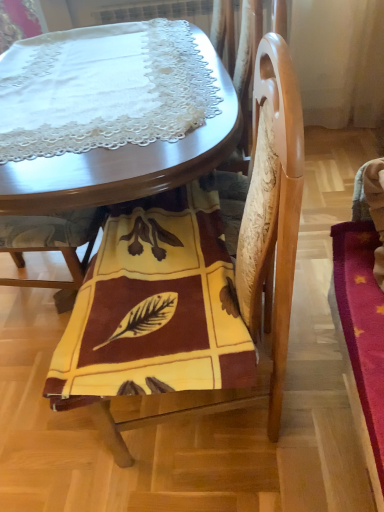
The width and height of the screenshot is (384, 512). Describe the element at coordinates (52, 246) in the screenshot. I see `yellow fabric chair at center, marked as the first chair in a left-to-right arrangement` at that location.

Measure the distance between point (226, 93) and camera.

Point (226, 93) and camera are 1.31 meters apart.

Identify the location of yellow fabric at lower center. (154, 308).

Which of these two, wooden table at center or yellow fabric chair at center, which appears as the second chair when viewed from the right, is thinner?

Thinner between the two is yellow fabric chair at center, which appears as the second chair when viewed from the right.

Is wooden table at center far away from yellow fabric chair at center, which appears as the second chair when viewed from the right?

No.

Considering the relative positions of wooden table at center and yellow fabric chair at center, which appears as the second chair when viewed from the right, in the image provided, is wooden table at center to the left or to the right of yellow fabric chair at center, which appears as the second chair when viewed from the right,?

In the image, wooden table at center appears on the right side of yellow fabric chair at center, which appears as the second chair when viewed from the right.

What's the angular difference between wooden table at center and yellow fabric chair at center, which appears as the second chair when viewed from the right,'s facing directions?

They differ by 85.8 degrees in their facing directions.

Are yellow fabric at lower center and wooden table at center beside each other?

No, yellow fabric at lower center is not touching wooden table at center.

Is yellow fabric at lower center taller than wooden table at center?

No.

Considering the relative positions of yellow fabric at lower center and wooden table at center in the image provided, is yellow fabric at lower center to the left of wooden table at center from the viewer's perspective?

No, yellow fabric at lower center is not to the left of wooden table at center.

What are the coordinates of `chair below the yellow fabric chair at center, marked as the first chair in a left-to-right arrangement (from the image's perspective)` in the screenshot? It's located at point(189,278).

From the image's perspective, is yellow woolen blanket at center, which is the 2th chair from left to right, over yellow fabric chair at center, marked as the first chair in a left-to-right arrangement?

Actually, yellow woolen blanket at center, which is the 2th chair from left to right, appears below yellow fabric chair at center, marked as the first chair in a left-to-right arrangement, in the image.

Which object is further away from the camera, yellow woolen blanket at center, which is the 2th chair from left to right, or yellow fabric chair at center, marked as the first chair in a left-to-right arrangement?

yellow fabric chair at center, marked as the first chair in a left-to-right arrangement.

From a real-world perspective, is wooden table at center on yellow woolen blanket at center, which is the 2th chair from left to right?

No, from a real-world perspective, wooden table at center is not on top of yellow woolen blanket at center, which is the 2th chair from left to right.

From the picture: Considering the positions of objects wooden table at center and yellow woolen blanket at center, which is the 2th chair from left to right, in the image provided, who is more to the left, wooden table at center or yellow woolen blanket at center, which is the 2th chair from left to right,?

Positioned to the left is wooden table at center.

Is yellow woolen blanket at center, which is the 2th chair from left to right, completely or partially inside wooden table at center?

No.

From the image's perspective, who appears lower, wooden table at center or yellow woolen blanket at center, which is the 2th chair from left to right?

yellow woolen blanket at center, which is the 2th chair from left to right, from the image's perspective.

Is yellow fabric at lower center further to camera compared to yellow woolen blanket at center, which is the 2th chair from left to right?

Yes, the depth of yellow fabric at lower center is greater than that of yellow woolen blanket at center, which is the 2th chair from left to right.

From the image's perspective, is yellow fabric at lower center over yellow woolen blanket at center, which is the 2th chair from left to right?

Yes, from the image's perspective, yellow fabric at lower center is on top of yellow woolen blanket at center, which is the 2th chair from left to right.

Is yellow fabric at lower center facing away from yellow woolen blanket at center, the 1th chair positioned from the right?

Yes, yellow fabric at lower center is positioned with its back facing yellow woolen blanket at center, the 1th chair positioned from the right.

Is yellow fabric at lower center positioned beyond the bounds of yellow woolen blanket at center, which is the 2th chair from left to right?

Actually, yellow fabric at lower center is at least partially inside yellow woolen blanket at center, which is the 2th chair from left to right.

Identify the location of chair that appears on the left of wooden table at center. (52, 246).

Is yellow fabric chair at center, which appears as the second chair when viewed from the right, facing away from wooden table at center?

Absolutely, yellow fabric chair at center, which appears as the second chair when viewed from the right, is directed away from wooden table at center.

Between yellow fabric chair at center, marked as the first chair in a left-to-right arrangement, and wooden table at center, which one has larger width?

Wider between the two is wooden table at center.

Is yellow fabric chair at center, marked as the first chair in a left-to-right arrangement, surrounding wooden table at center?

That's incorrect, wooden table at center is not inside yellow fabric chair at center, marked as the first chair in a left-to-right arrangement.

Do you think yellow woolen blanket at center, which is the 2th chair from left to right, is within wooden table at center, or outside of it?

yellow woolen blanket at center, which is the 2th chair from left to right, cannot be found inside wooden table at center.

Can you confirm if yellow woolen blanket at center, the 1th chair positioned from the right, is thinner than wooden table at center?

Yes, yellow woolen blanket at center, the 1th chair positioned from the right, is thinner than wooden table at center.

From the image's perspective, is yellow woolen blanket at center, the 1th chair positioned from the right, above or below wooden table at center?

yellow woolen blanket at center, the 1th chair positioned from the right, is situated lower than wooden table at center in the image.

I want to click on table behind the yellow fabric chair at center, which appears as the second chair when viewed from the right, so click(102, 194).

Identify the location of blanket located above the wooden table at center (from a real-world perspective). The width and height of the screenshot is (384, 512). (154, 308).

From the image, which object appears to be farther from yellow woolen blanket at center, the 1th chair positioned from the right, yellow fabric at lower center or yellow fabric chair at center, marked as the first chair in a left-to-right arrangement?

yellow fabric chair at center, marked as the first chair in a left-to-right arrangement, lies further to yellow woolen blanket at center, the 1th chair positioned from the right, than the other object.

Estimate the real-world distances between objects in this image. Which object is further from yellow fabric chair at center, marked as the first chair in a left-to-right arrangement, wooden table at center or yellow fabric at lower center?

Based on the image, yellow fabric at lower center appears to be further to yellow fabric chair at center, marked as the first chair in a left-to-right arrangement.

Considering their positions, is yellow fabric at lower center positioned further to wooden table at center than yellow fabric chair at center, marked as the first chair in a left-to-right arrangement?

Based on the image, yellow fabric chair at center, marked as the first chair in a left-to-right arrangement, appears to be further to wooden table at center.

From the image, which object appears to be farther from yellow fabric at lower center, yellow woolen blanket at center, which is the 2th chair from left to right, or wooden table at center?

wooden table at center is positioned further to the anchor yellow fabric at lower center.

Based on their spatial positions, is yellow fabric chair at center, marked as the first chair in a left-to-right arrangement, or yellow woolen blanket at center, the 1th chair positioned from the right, closer to wooden table at center?

The object closer to wooden table at center is yellow woolen blanket at center, the 1th chair positioned from the right.

Looking at the image, which one is located further to yellow fabric at lower center, yellow fabric chair at center, which appears as the second chair when viewed from the right, or wooden table at center?

yellow fabric chair at center, which appears as the second chair when viewed from the right, is positioned further to the anchor yellow fabric at lower center.

Which object lies further to the anchor point wooden table at center, yellow woolen blanket at center, which is the 2th chair from left to right, or yellow fabric at lower center?

The object further to wooden table at center is yellow woolen blanket at center, which is the 2th chair from left to right.

From the image, which object appears to be nearer to wooden table at center, yellow woolen blanket at center, which is the 2th chair from left to right, or yellow fabric chair at center, marked as the first chair in a left-to-right arrangement?

yellow woolen blanket at center, which is the 2th chair from left to right, lies closer to wooden table at center than the other object.

Locate an element on the screen. The width and height of the screenshot is (384, 512). blanket positioned between yellow woolen blanket at center, the 1th chair positioned from the right, and wooden table at center from near to far is located at coordinates (154, 308).

The height and width of the screenshot is (512, 384). In order to click on table located between yellow fabric chair at center, marked as the first chair in a left-to-right arrangement, and yellow fabric at lower center in the left-right direction in this screenshot , I will do `click(102, 194)`.

The height and width of the screenshot is (512, 384). What are the coordinates of `blanket between yellow fabric chair at center, marked as the first chair in a left-to-right arrangement, and yellow woolen blanket at center, which is the 2th chair from left to right, in the horizontal direction` in the screenshot? It's located at (154, 308).

The image size is (384, 512). In order to click on chair positioned between yellow woolen blanket at center, which is the 2th chair from left to right, and wooden table at center from near to far in this screenshot , I will do coord(52,246).